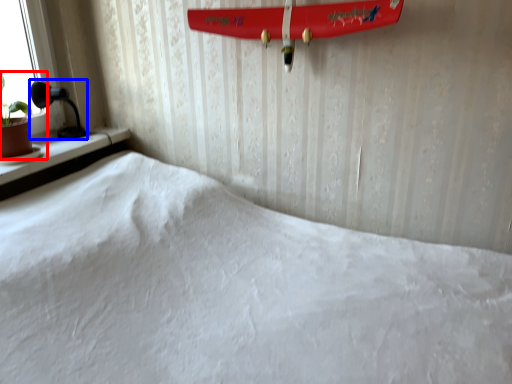
Question: Which object is further to the camera taking this photo, houseplant (highlighted by a red box) or table lamp (highlighted by a blue box)?

Choices:
 (A) houseplant
 (B) table lamp

Answer: (B)